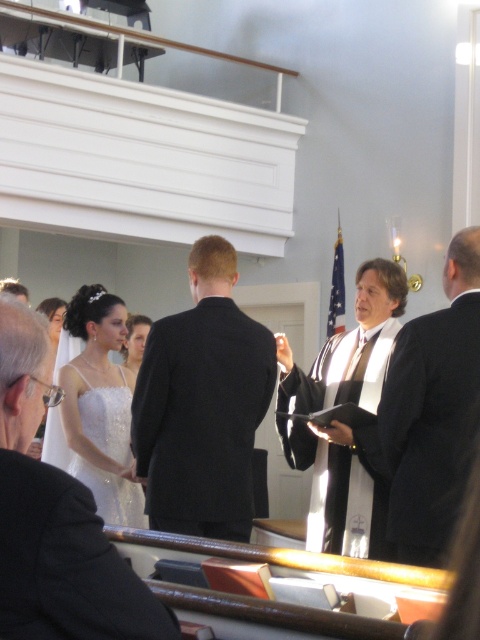
You are a photographer standing behind the black suit at center and the sequined satin dress at center. You want to capture a photo of both of them together. Can you fit both of them into your camera frame if your camera has a minimum required distance of 1.0 meters between subjects to capture them both clearly?

The distance between the black suit at center and the sequined satin dress at center is 1.07 meters, which is just above the camera requirement of 1.0 meters. Therefore, the photographer can fit both subjects into the camera frame.

You are attending a wedding and notice a black silk robe at right. Where exactly is it located in the image?

The black silk robe at right is located at point coordinates of (432, 410).

You are a photographer at a wedding ceremony. You need to capture a photo of the black suit at center and the sequined satin dress at center. Which one is positioned higher in the frame?

The black suit at center is located above the sequined satin dress at center, so it is positioned higher in the frame.